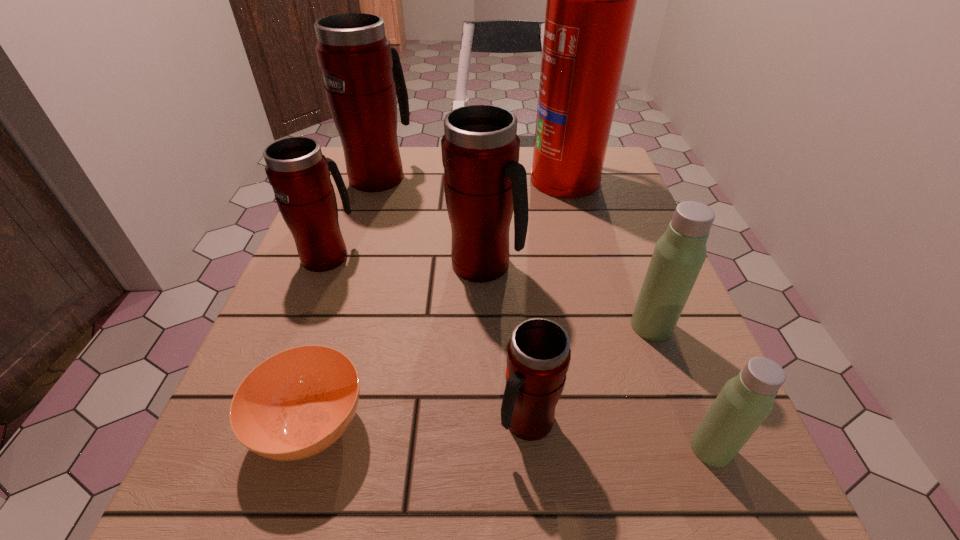
Where is `object positioned at the far left corner`? The height and width of the screenshot is (540, 960). object positioned at the far left corner is located at coordinates (362, 72).

Find the location of a particular element. object situated at the near left corner is located at coordinates (297, 403).

Image resolution: width=960 pixels, height=540 pixels. What are the coordinates of `object at the far right corner` in the screenshot? It's located at (591, 0).

The width and height of the screenshot is (960, 540). Find the location of `free space at the far edge of the desktop`. free space at the far edge of the desktop is located at coordinates (413, 170).

Locate an element on the screen. The image size is (960, 540). free location at the near edge is located at coordinates tap(379, 496).

Where is `vacant space at the left edge of the desktop`? vacant space at the left edge of the desktop is located at coordinates (265, 325).

At what (x,y) coordinates should I click in order to perform the action: click on vacant space at the right edge of the desktop. Please return your answer as a coordinate pair (x, y). Looking at the image, I should click on (612, 333).

The image size is (960, 540). I want to click on blank region between the third biggest red thermos bottle and the smallest red thermos bottle, so click(x=427, y=339).

At what (x,y) coordinates should I click in order to perform the action: click on free space between the third smallest red thermos bottle and the second tallest object. Please return your answer as a coordinate pair (x, y). Looking at the image, I should click on (432, 221).

The width and height of the screenshot is (960, 540). Identify the location of vacant space in between the farthest red thermos bottle and the smallest red thermos bottle. (454, 299).